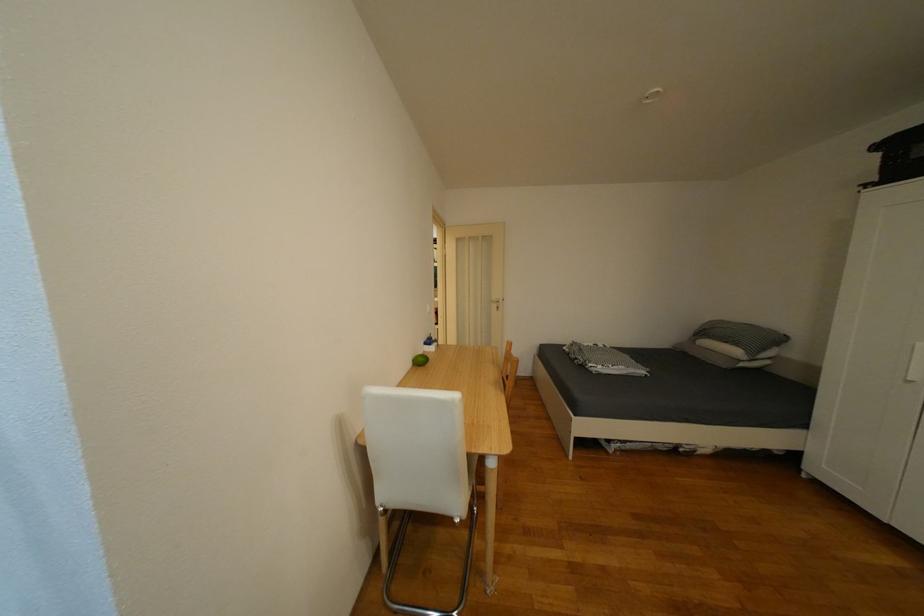
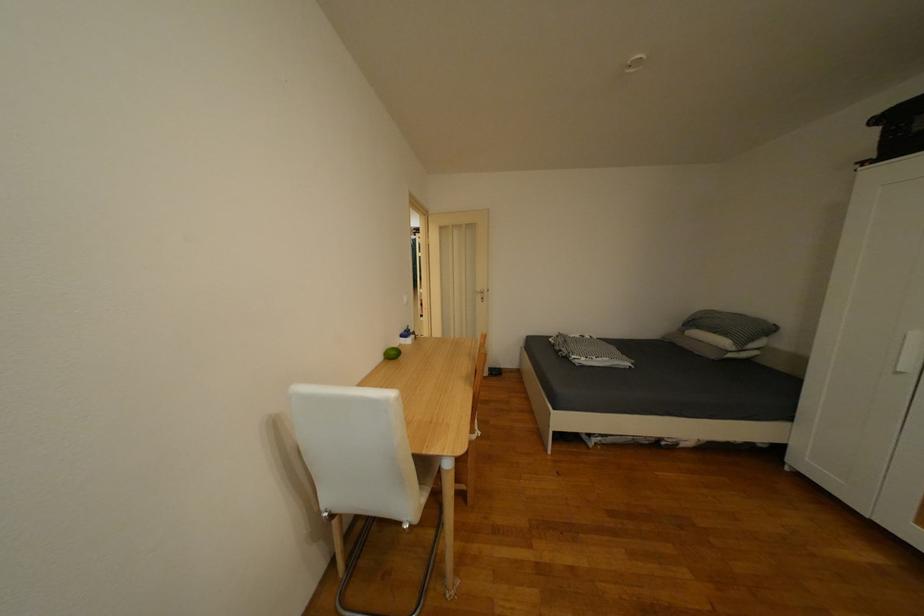
What movement of the cameraman would produce the second image?

The cameraman moved toward right, forward.